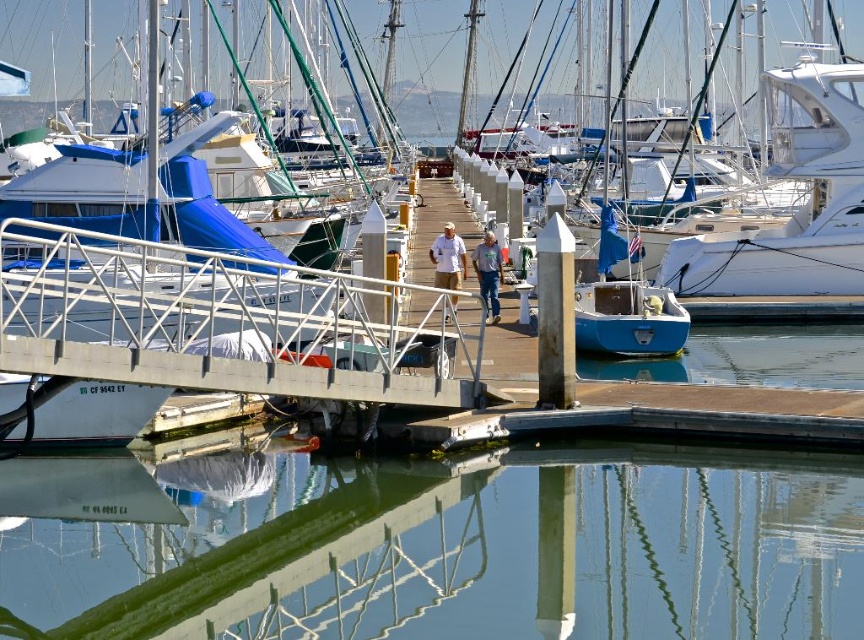
Between clear glass water at center and blue jeans at center, which one is positioned higher?

blue jeans at center

Does clear glass water at center appear on the right side of blue jeans at center?

In fact, clear glass water at center is to the left of blue jeans at center.

You are a GUI agent. You are given a task and a screenshot of the screen. Output one action in this format:
    pyautogui.click(x=<x>, y=<y>)
    Task: Click on the clear glass water at center
    
    Given the screenshot: What is the action you would take?
    pyautogui.click(x=443, y=544)

Find the location of `white matte shirt at center`. white matte shirt at center is located at coordinates (448, 259).

Can you confirm if white matte shirt at center is thinner than blue jeans at center?

No, white matte shirt at center is not thinner than blue jeans at center.

Find the location of `white matte shirt at center`. white matte shirt at center is located at coordinates (448, 259).

Locate an element on the screen. white matte shirt at center is located at coordinates (448, 259).

Is the position of clear glass water at center more distant than that of white matte shirt at center?

That is False.

Can you confirm if clear glass water at center is thinner than white matte shirt at center?

No, clear glass water at center is not thinner than white matte shirt at center.

Between point (569, 568) and point (453, 275), which one is positioned behind?

The point (453, 275) is more distant.

At what (x,y) coordinates should I click in order to perform the action: click on clear glass water at center. Please return your answer as a coordinate pair (x, y). Image resolution: width=864 pixels, height=640 pixels. Looking at the image, I should click on (443, 544).